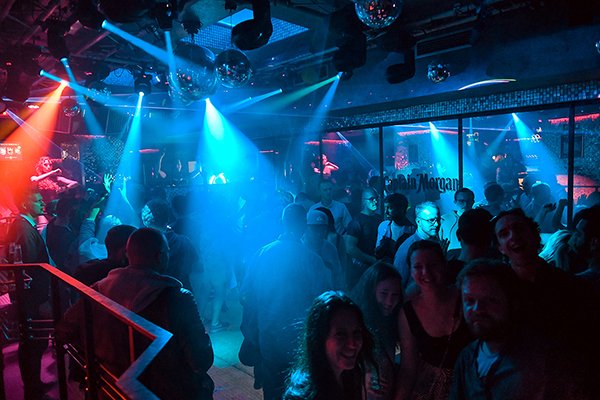
The height and width of the screenshot is (400, 600). Identify the location of disco ball. (384, 15), (524, 168).